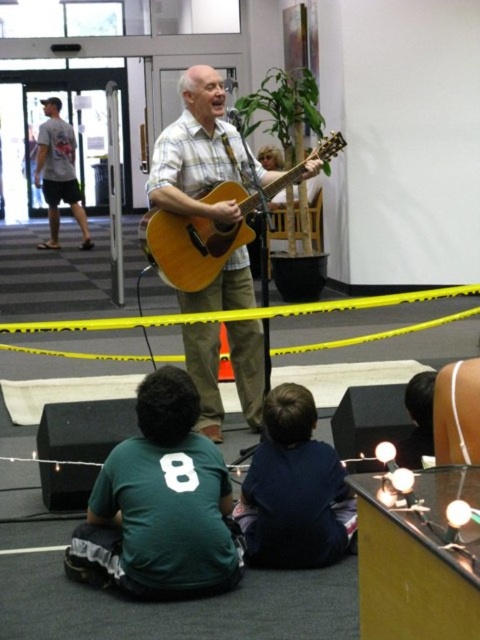
Question: Is the position of green jersey at lower left more distant than that of matte black guitar at center?

Choices:
 (A) yes
 (B) no

Answer: (B)

Question: Is green jersey at lower left behind gray t-shirt at left?

Choices:
 (A) yes
 (B) no

Answer: (B)

Question: Which object is farther from the camera taking this photo?

Choices:
 (A) wooden acoustic guitar at center
 (B) gray t-shirt at left

Answer: (B)

Question: Which of the following is the farthest from the observer?

Choices:
 (A) (144, 436)
 (B) (71, 205)
 (C) (278, 560)

Answer: (B)

Question: Is dark blue shirt at lower center to the left of gray t-shirt at left from the viewer's perspective?

Choices:
 (A) no
 (B) yes

Answer: (A)

Question: Which point appears closest to the camera in this image?

Choices:
 (A) (284, 387)
 (B) (168, 227)

Answer: (A)